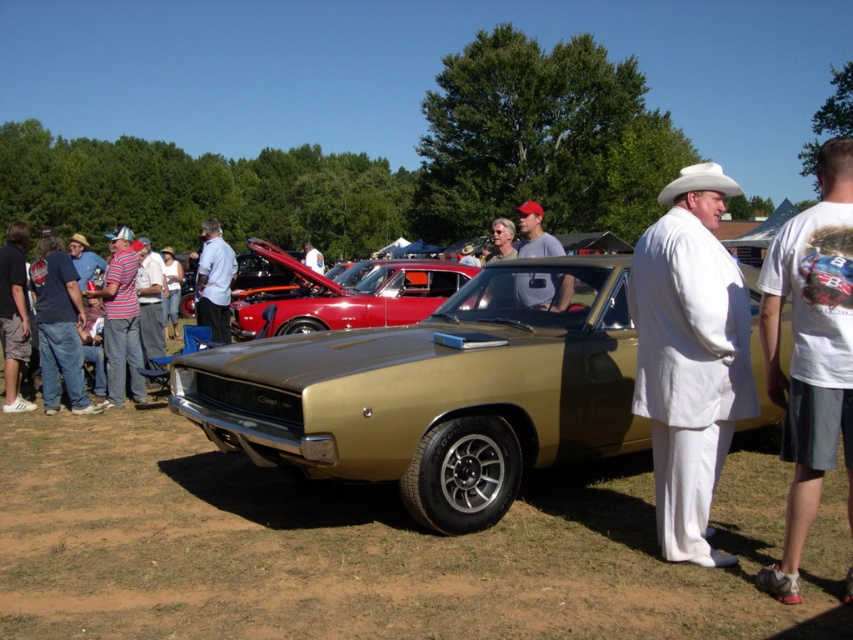
You are standing at the point marked as point [436,394] in the image. What object are you currently standing on?

You are standing on the gold metallic muscle car at center, as the point [436,394] is located on it.

You are attending the car show and need to find the white cotton suit at center. Based on the coordinates provided, where should you look relative to the vintage gold muscle car?

The white cotton suit at center is located at coordinates point (689, 356), which places it near the center of the image, likely positioned in the middle area between the foreground and background cars, closer to the vintage gold muscle car since it is in the foreground.